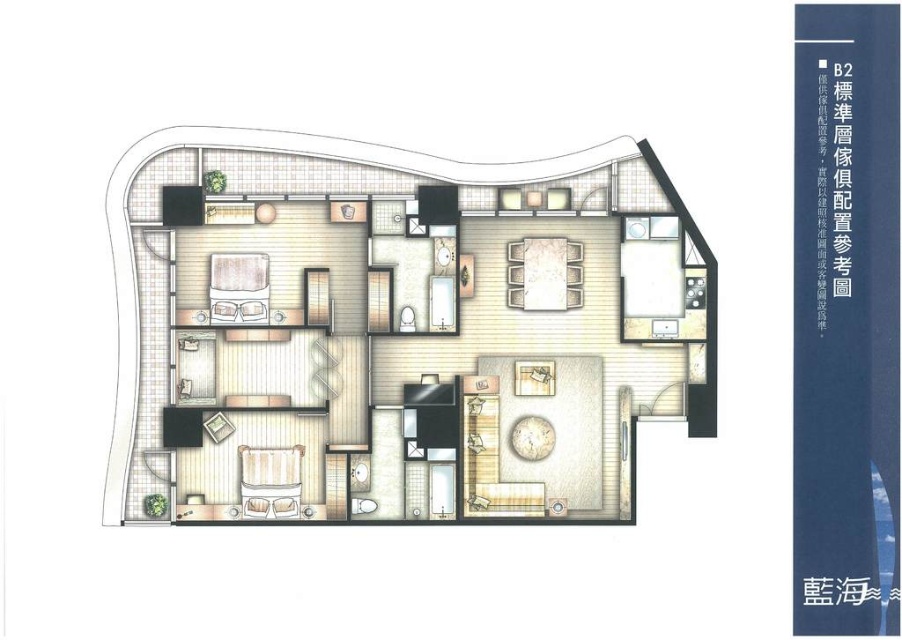
Question: Does matte wood coffee table at center appear on the right side of matte white bed at center?

Choices:
 (A) yes
 (B) no

Answer: (A)

Question: Is matte wood coffee table at center smaller than matte white bed at center?

Choices:
 (A) no
 (B) yes

Answer: (A)

Question: Among these points, which one is nearest to the camera?

Choices:
 (A) (281, 472)
 (B) (431, 380)

Answer: (B)

Question: Considering the real-world distances, which object is farthest from the striped fabric bed at center?

Choices:
 (A) matte wood coffee table at center
 (B) matte white bed at center

Answer: (B)

Question: Does matte wood coffee table at center appear under striped fabric bed at center?

Choices:
 (A) yes
 (B) no

Answer: (B)

Question: Among these objects, which one is nearest to the camera?

Choices:
 (A) matte wood coffee table at center
 (B) striped fabric bed at center
 (C) matte white bed at center

Answer: (A)